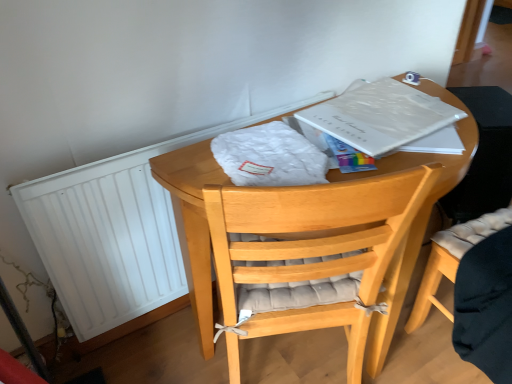
Question: From a real-world perspective, is light brown wooden chair at center located beneath white paper at upper right?

Choices:
 (A) yes
 (B) no

Answer: (A)

Question: Is light brown wooden chair at center placed right next to white paper at upper right?

Choices:
 (A) no
 (B) yes

Answer: (A)

Question: Is light brown wooden chair at center oriented away from white paper at upper right?

Choices:
 (A) yes
 (B) no

Answer: (B)

Question: Is light brown wooden chair at center not within white paper at upper right?

Choices:
 (A) yes
 (B) no

Answer: (A)

Question: Is light brown wooden chair at center positioned behind white paper at upper right?

Choices:
 (A) yes
 (B) no

Answer: (B)

Question: Visually, is wooden round table at center positioned to the left or to the right of white paper at upper right?

Choices:
 (A) left
 (B) right

Answer: (A)

Question: From a real-world perspective, is wooden round table at center above or below white paper at upper right?

Choices:
 (A) below
 (B) above

Answer: (A)

Question: Considering the positions of wooden round table at center and white paper at upper right in the image, is wooden round table at center wider or thinner than white paper at upper right?

Choices:
 (A) wide
 (B) thin

Answer: (A)

Question: Do you think wooden round table at center is within white paper at upper right, or outside of it?

Choices:
 (A) inside
 (B) outside

Answer: (B)

Question: Is point (185, 228) closer or farther from the camera than point (443, 256)?

Choices:
 (A) farther
 (B) closer

Answer: (B)

Question: From a real-world perspective, is wooden round table at center positioned above or below light brown wooden chair at center?

Choices:
 (A) below
 (B) above

Answer: (B)

Question: Visually, is wooden round table at center positioned to the left or to the right of light brown wooden chair at center?

Choices:
 (A) left
 (B) right

Answer: (A)

Question: Relative to light brown wooden chair at center, is wooden round table at center in front or behind?

Choices:
 (A) front
 (B) behind

Answer: (A)

Question: Does point (69, 218) appear closer or farther from the camera than point (389, 100)?

Choices:
 (A) closer
 (B) farther

Answer: (A)

Question: From their relative heights in the image, would you say white matte radiator at left is taller or shorter than white paper at upper right?

Choices:
 (A) tall
 (B) short

Answer: (A)